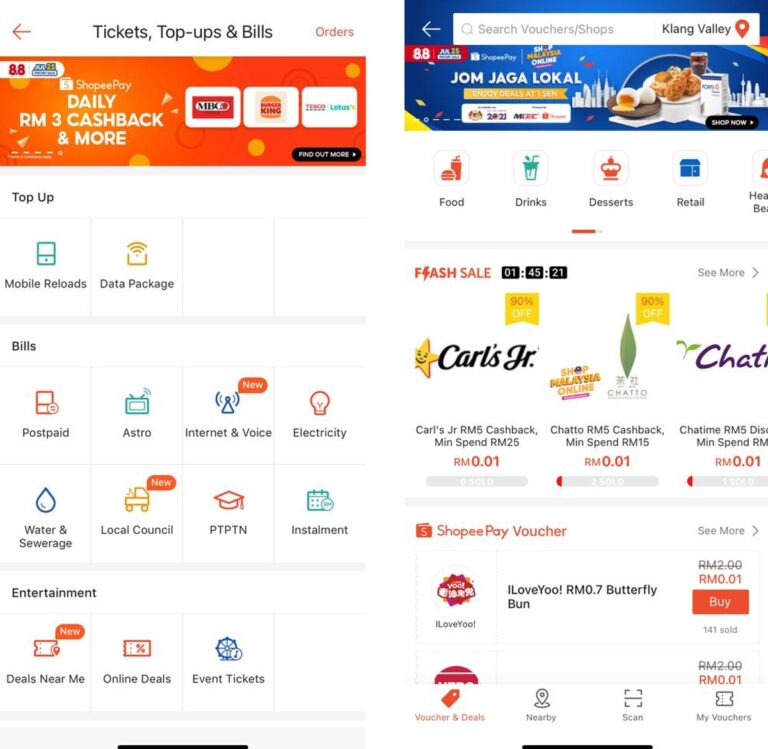
Where is `screen 1`? screen 1 is located at coordinates (78, 22).